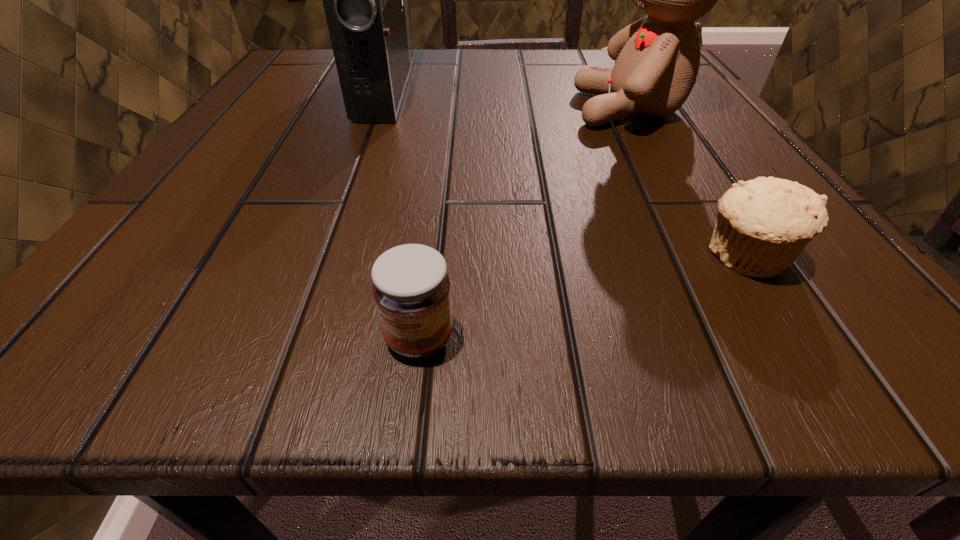
Where is `vacant area at the right edge of the desktop`? This screenshot has height=540, width=960. vacant area at the right edge of the desktop is located at coordinates (677, 113).

The height and width of the screenshot is (540, 960). In order to click on vacant space at the far left corner of the desktop in this screenshot , I will do `click(315, 66)`.

The height and width of the screenshot is (540, 960). In the image, there is a desktop. In order to click on vacant space at the near right corner in this screenshot , I will do `click(765, 318)`.

Identify the location of free space between the nearest object and the muffin. This screenshot has height=540, width=960. (582, 297).

Locate an element on the screen. The image size is (960, 540). vacant point located between the radio receiver and the nearest object is located at coordinates (403, 213).

Locate an element on the screen. Image resolution: width=960 pixels, height=540 pixels. free spot between the second object from left to right and the muffin is located at coordinates (582, 297).

At what (x,y) coordinates should I click in order to perform the action: click on empty space between the leftmost object and the muffin. Please return your answer as a coordinate pair (x, y). Looking at the image, I should click on (565, 172).

Where is `vacant area that lies between the second nearest object and the rag_doll`? This screenshot has height=540, width=960. vacant area that lies between the second nearest object and the rag_doll is located at coordinates (688, 183).

The height and width of the screenshot is (540, 960). I want to click on vacant area between the rag_doll and the second nearest object, so click(x=688, y=183).

Identify the location of free spot between the muffin and the radio receiver. The image size is (960, 540). (565, 172).